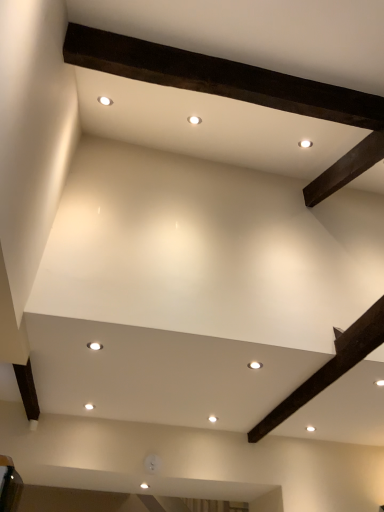
At what (x,y) coordinates should I click in order to perform the action: click on white glossy light fixture at center, placed as the first lighting when sorted from back to front. Please return your answer as a coordinate pair (x, y). Looking at the image, I should click on tap(255, 365).

The width and height of the screenshot is (384, 512). What do you see at coordinates (255, 365) in the screenshot? I see `white glossy light fixture at center, which ranks as the second lighting in top-to-bottom order` at bounding box center [255, 365].

Image resolution: width=384 pixels, height=512 pixels. What do you see at coordinates (94, 346) in the screenshot?
I see `white glossy light fixture at center, placed as the first lighting when sorted from left to right` at bounding box center [94, 346].

You are a GUI agent. You are given a task and a screenshot of the screen. Output one action in this format:
    pyautogui.click(x=<x>, y=<y>)
    Task: Click on the white glossy light fixture at center, which appears as the first lighting when viewed from the top
    Image resolution: width=384 pixels, height=512 pixels.
    Given the screenshot: What is the action you would take?
    pyautogui.click(x=94, y=346)

Find the location of `white glossy light fixture at center, placed as the first lighting when sorted from back to front`. white glossy light fixture at center, placed as the first lighting when sorted from back to front is located at coordinates [x=255, y=365].

Considering the relative positions of white glossy light fixture at center, the second lighting viewed from the front, and white glossy light fixture at center, which ranks as the 2th lighting in right-to-left order, in the image provided, is white glossy light fixture at center, the second lighting viewed from the front, to the left of white glossy light fixture at center, which ranks as the 2th lighting in right-to-left order, from the viewer's perspective?

No, white glossy light fixture at center, the second lighting viewed from the front, is not to the left of white glossy light fixture at center, which ranks as the 2th lighting in right-to-left order.

Is white glossy light fixture at center, which ranks as the second lighting in top-to-bottom order, in front of or behind white glossy light fixture at center, which ranks as the 2th lighting in right-to-left order, in the image?

white glossy light fixture at center, which ranks as the second lighting in top-to-bottom order, is positioned farther from the viewer than white glossy light fixture at center, which ranks as the 2th lighting in right-to-left order.

Between point (255, 367) and point (88, 346), which one is positioned behind?

The point (255, 367) is farther.

From the image's perspective, would you say white glossy light fixture at center, which appears as the first lighting when ordered from the bottom, is positioned over white glossy light fixture at center, which is counted as the second lighting, starting from the bottom?

No, from the image's perspective, white glossy light fixture at center, which appears as the first lighting when ordered from the bottom, is not above white glossy light fixture at center, which is counted as the second lighting, starting from the bottom.

From a real-world perspective, who is located higher, white glossy light fixture at center, which appears as the first lighting when ordered from the bottom, or white glossy light fixture at center, acting as the 2th lighting starting from the back?

white glossy light fixture at center, which appears as the first lighting when ordered from the bottom, is physically above.

Can you confirm if white glossy light fixture at center, acting as the first lighting starting from the right, is wider than white glossy light fixture at center, which appears as the first lighting when viewed from the top?

Correct, the width of white glossy light fixture at center, acting as the first lighting starting from the right, exceeds that of white glossy light fixture at center, which appears as the first lighting when viewed from the top.

Based on the photo, does white glossy light fixture at center, placed as the first lighting when sorted from back to front, have a greater height compared to white glossy light fixture at center, acting as the 2th lighting starting from the back?

Incorrect, the height of white glossy light fixture at center, placed as the first lighting when sorted from back to front, is not larger of that of white glossy light fixture at center, acting as the 2th lighting starting from the back.

Looking at this image, is white glossy light fixture at center, the second lighting from the left, smaller than white glossy light fixture at center, which ranks as the 2th lighting in right-to-left order?

Correct, white glossy light fixture at center, the second lighting from the left, occupies less space than white glossy light fixture at center, which ranks as the 2th lighting in right-to-left order.

Can we say white glossy light fixture at center, the second lighting viewed from the front, lies outside white glossy light fixture at center, placed as the first lighting when sorted from left to right?

Yes, white glossy light fixture at center, the second lighting viewed from the front, is outside of white glossy light fixture at center, placed as the first lighting when sorted from left to right.

Is white glossy light fixture at center, the second lighting from the left, far away from white glossy light fixture at center, which is counted as the second lighting, starting from the bottom?

No, white glossy light fixture at center, the second lighting from the left, is in close proximity to white glossy light fixture at center, which is counted as the second lighting, starting from the bottom.

Is white glossy light fixture at center, the second lighting from the left, positioned with its back to white glossy light fixture at center, placed as the first lighting when sorted from left to right?

No, white glossy light fixture at center, the second lighting from the left, is not facing the opposite direction of white glossy light fixture at center, placed as the first lighting when sorted from left to right.

How different are the orientations of white glossy light fixture at center, the second lighting viewed from the front, and white glossy light fixture at center, the first lighting positioned from the front, in degrees?

They differ by 6.1 degrees in their facing directions.

Find the location of a particular element. Image resolution: width=384 pixels, height=512 pixels. lighting that is on the right side of white glossy light fixture at center, which ranks as the 2th lighting in right-to-left order is located at coordinates (255, 365).

Does white glossy light fixture at center, which appears as the first lighting when viewed from the top, appear on the right side of white glossy light fixture at center, which appears as the first lighting when ordered from the bottom?

In fact, white glossy light fixture at center, which appears as the first lighting when viewed from the top, is to the left of white glossy light fixture at center, which appears as the first lighting when ordered from the bottom.

Relative to white glossy light fixture at center, acting as the first lighting starting from the right, is white glossy light fixture at center, placed as the first lighting when sorted from left to right, in front or behind?

white glossy light fixture at center, placed as the first lighting when sorted from left to right, is in front of white glossy light fixture at center, acting as the first lighting starting from the right.

Which is in front, point (95, 344) or point (257, 361)?

The point (95, 344) is in front.

From the image's perspective, which one is positioned higher, white glossy light fixture at center, which appears as the first lighting when viewed from the top, or white glossy light fixture at center, which ranks as the second lighting in top-to-bottom order?

white glossy light fixture at center, which appears as the first lighting when viewed from the top, is shown above in the image.

From a real-world perspective, is white glossy light fixture at center, the first lighting positioned from the front, physically located above or below white glossy light fixture at center, which ranks as the second lighting in top-to-bottom order?

From a real-world perspective, white glossy light fixture at center, the first lighting positioned from the front, is physically below white glossy light fixture at center, which ranks as the second lighting in top-to-bottom order.

Between white glossy light fixture at center, which appears as the first lighting when viewed from the top, and white glossy light fixture at center, the second lighting from the left, which one has larger width?

Wider between the two is white glossy light fixture at center, the second lighting from the left.

Considering the sizes of objects white glossy light fixture at center, which is counted as the second lighting, starting from the bottom, and white glossy light fixture at center, placed as the first lighting when sorted from back to front, in the image provided, who is shorter, white glossy light fixture at center, which is counted as the second lighting, starting from the bottom, or white glossy light fixture at center, placed as the first lighting when sorted from back to front,?

With less height is white glossy light fixture at center, placed as the first lighting when sorted from back to front.

Between white glossy light fixture at center, which appears as the first lighting when viewed from the top, and white glossy light fixture at center, acting as the first lighting starting from the right, which one has larger size?

white glossy light fixture at center, which appears as the first lighting when viewed from the top, is bigger.

Would you say white glossy light fixture at center, acting as the first lighting starting from the right, is part of white glossy light fixture at center, acting as the 2th lighting starting from the back,'s contents?

No, white glossy light fixture at center, acting as the first lighting starting from the right, is not inside white glossy light fixture at center, acting as the 2th lighting starting from the back.

Are white glossy light fixture at center, the first lighting positioned from the front, and white glossy light fixture at center, which ranks as the second lighting in top-to-bottom order, far apart?

white glossy light fixture at center, the first lighting positioned from the front, is actually quite close to white glossy light fixture at center, which ranks as the second lighting in top-to-bottom order.

Is white glossy light fixture at center, acting as the 2th lighting starting from the back, looking in the opposite direction of white glossy light fixture at center, acting as the first lighting starting from the right?

No, white glossy light fixture at center, acting as the first lighting starting from the right, is not at the back of white glossy light fixture at center, acting as the 2th lighting starting from the back.

What's the angular difference between white glossy light fixture at center, which is counted as the second lighting, starting from the bottom, and white glossy light fixture at center, placed as the first lighting when sorted from back to front,'s facing directions?

6.1 degrees separate the facing orientations of white glossy light fixture at center, which is counted as the second lighting, starting from the bottom, and white glossy light fixture at center, placed as the first lighting when sorted from back to front.

In order to click on lighting located above the white glossy light fixture at center, which appears as the first lighting when viewed from the top (from a real-world perspective) in this screenshot , I will do `click(255, 365)`.

The image size is (384, 512). Identify the location of lighting that appears above the white glossy light fixture at center, the second lighting viewed from the front (from the image's perspective). (94, 346).

Locate an element on the screen. lighting on the left side of white glossy light fixture at center, the second lighting viewed from the front is located at coordinates (94, 346).